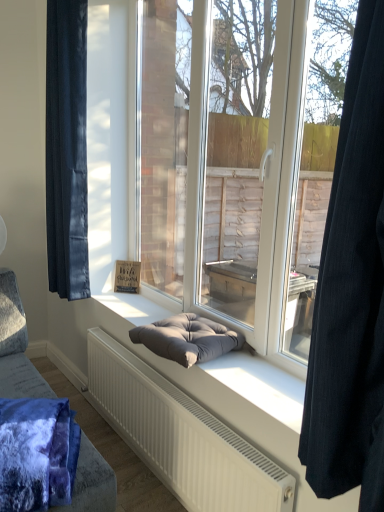
Question: From a real-world perspective, is velvet dark blue curtain at left, which is the second curtain from front to back, physically located above or below black fabric curtain at right, placed as the 1th curtain when sorted from right to left?

Choices:
 (A) below
 (B) above

Answer: (B)

Question: Is velvet dark blue curtain at left, which appears as the 2th curtain when viewed from the right, inside the boundaries of black fabric curtain at right, the 2th curtain viewed from the left, or outside?

Choices:
 (A) inside
 (B) outside

Answer: (B)

Question: Which of these objects is positioned closest to the velvety blue blanket at lower left?

Choices:
 (A) black fabric curtain at right, placed as the 1th curtain when sorted from right to left
 (B) velvet dark blue curtain at left, which appears as the 2th curtain when viewed from the right
 (C) matte gray cushion at center
 (D) dark gray cushion at center
 (E) dark gray fabric footrest at center

Answer: (E)

Question: Which object is positioned closest to the matte gray cushion at center?

Choices:
 (A) black fabric curtain at right, the 2th curtain viewed from the left
 (B) velvety blue blanket at lower left
 (C) dark gray cushion at center
 (D) velvet dark blue curtain at left, the first curtain when ordered from back to front
 (E) dark gray fabric footrest at center

Answer: (E)